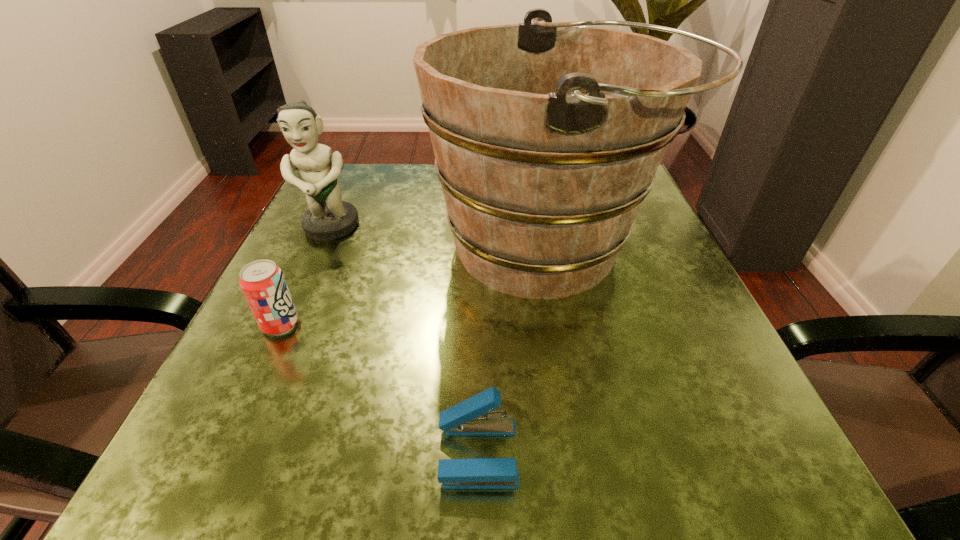
Where is `the tallest object`? This screenshot has width=960, height=540. the tallest object is located at coordinates (547, 137).

Identify the location of the second tallest object. This screenshot has width=960, height=540. (328, 218).

This screenshot has width=960, height=540. I want to click on soda can, so click(x=264, y=286).

This screenshot has height=540, width=960. Identify the location of stapler. (472, 417).

Where is `the shortest object`? the shortest object is located at coordinates (472, 417).

I want to click on vacant space located 0.380m on the front-facing side of the second tallest object, so click(248, 415).

Where is `vacant space positioned 0.110m on the front of the third tallest object`? The image size is (960, 540). vacant space positioned 0.110m on the front of the third tallest object is located at coordinates (247, 398).

Locate an element on the screen. blank space located on the left of the nearest object is located at coordinates (242, 453).

Identify the location of bucket positioned at the far edge. (547, 137).

Identify the location of figurine that is at the far edge. This screenshot has height=540, width=960. (328, 218).